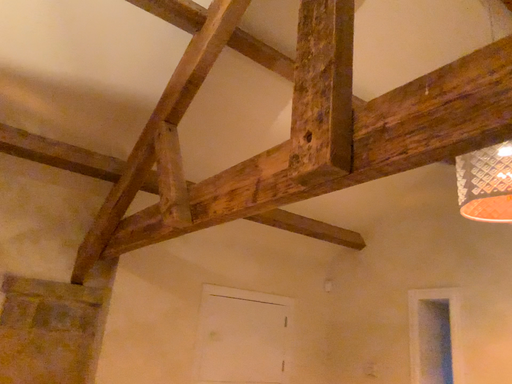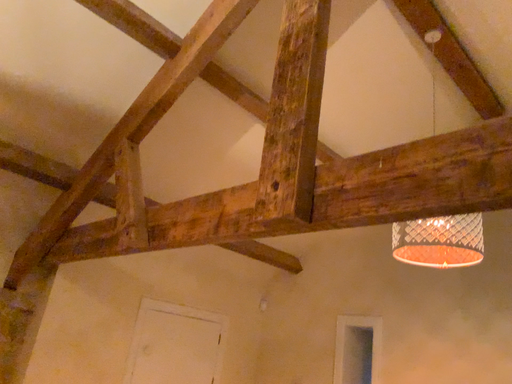
Question: How did the camera likely rotate when shooting the video?

Choices:
 (A) rotated left
 (B) rotated right

Answer: (B)